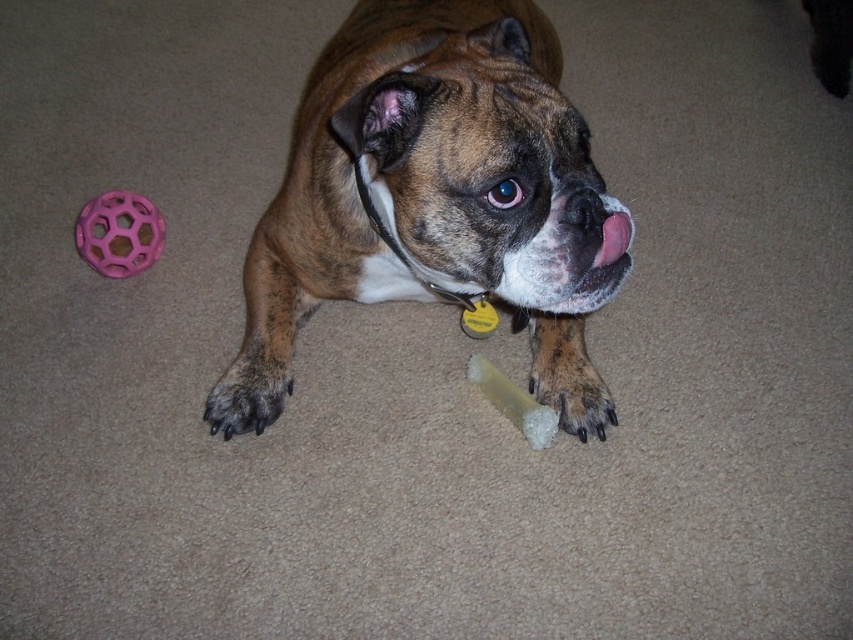
Question: Is the position of brown matte dog at center less distant than that of pink rubber ball at upper left?

Choices:
 (A) yes
 (B) no

Answer: (A)

Question: Can you confirm if brown matte dog at center is positioned below pink rubber ball at upper left?

Choices:
 (A) yes
 (B) no

Answer: (B)

Question: Which point is closer to the camera taking this photo?

Choices:
 (A) (604, 236)
 (B) (451, 81)

Answer: (B)

Question: Is brown matte dog at center above pink rubber ball at upper left?

Choices:
 (A) no
 (B) yes

Answer: (B)

Question: Which point is farther from the camera taking this photo?

Choices:
 (A) (630, 234)
 (B) (473, 157)

Answer: (A)

Question: Which point is closer to the camera?

Choices:
 (A) (370, 256)
 (B) (601, 257)

Answer: (B)